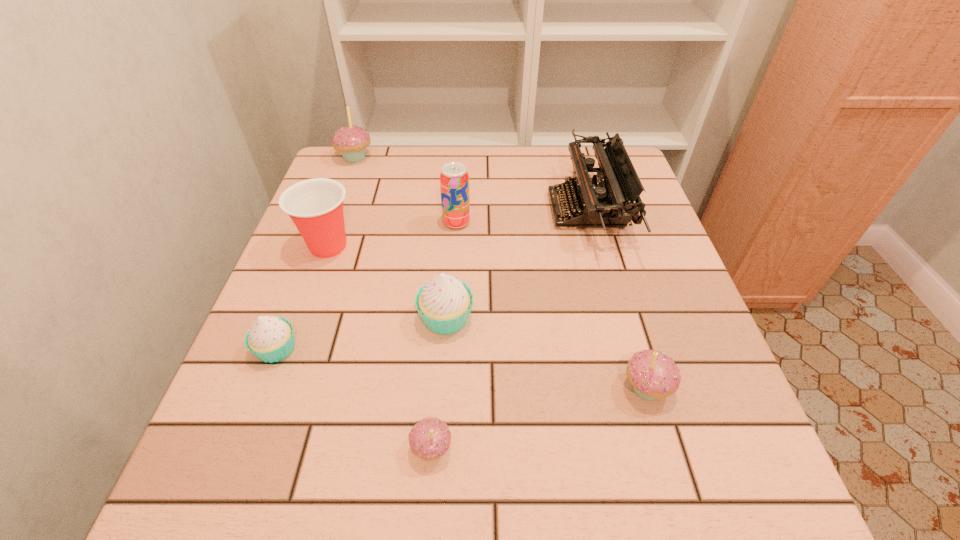
Locate an element on the screen. vacant area situated on the right of the nearest pink cupcake is located at coordinates (679, 448).

You are a GUI agent. You are given a task and a screenshot of the screen. Output one action in this format:
    pyautogui.click(x=<x>, y=<y>)
    Task: Click on the cupcake at the far edge
    The width and height of the screenshot is (960, 540).
    Given the screenshot: What is the action you would take?
    pyautogui.click(x=351, y=141)

Find the location of `typewriter located at the far edge`. typewriter located at the far edge is located at coordinates (604, 203).

The image size is (960, 540). Find the location of `object located in the near edge section of the desktop`. object located in the near edge section of the desktop is located at coordinates (430, 438).

This screenshot has width=960, height=540. In order to click on cup at the left edge in this screenshot , I will do `click(315, 206)`.

The width and height of the screenshot is (960, 540). Find the location of `typewriter that is at the right edge`. typewriter that is at the right edge is located at coordinates (604, 203).

The image size is (960, 540). What are the coordinates of `cupcake positioned at the right edge` in the screenshot? It's located at (652, 374).

I want to click on object present at the far left corner, so 351,141.

Where is `object that is positioned at the far right corner`? This screenshot has height=540, width=960. object that is positioned at the far right corner is located at coordinates (604, 203).

Where is `free region at the far edge of the desktop`? The width and height of the screenshot is (960, 540). free region at the far edge of the desktop is located at coordinates (556, 151).